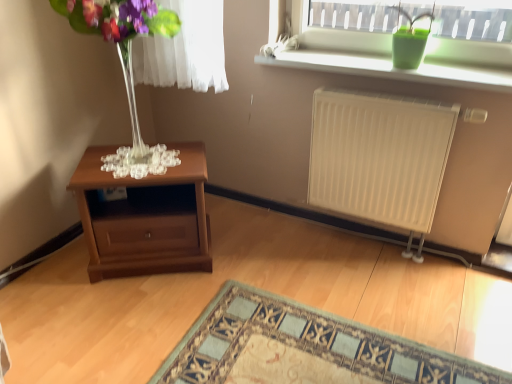
Question: Considering the relative sizes of white matte radiator at right and transparent glass vase at left in the image provided, is white matte radiator at right taller than transparent glass vase at left?

Choices:
 (A) yes
 (B) no

Answer: (A)

Question: Considering the relative positions of white matte radiator at right and transparent glass vase at left in the image provided, is white matte radiator at right to the right of transparent glass vase at left from the viewer's perspective?

Choices:
 (A) yes
 (B) no

Answer: (A)

Question: Can you confirm if white matte radiator at right is positioned to the left of transparent glass vase at left?

Choices:
 (A) no
 (B) yes

Answer: (A)

Question: From the image's perspective, is white matte radiator at right beneath transparent glass vase at left?

Choices:
 (A) no
 (B) yes

Answer: (B)

Question: Would you say white matte radiator at right contains transparent glass vase at left?

Choices:
 (A) no
 (B) yes

Answer: (A)

Question: From a real-world perspective, does white matte radiator at right sit lower than transparent glass vase at left?

Choices:
 (A) yes
 (B) no

Answer: (A)

Question: Would you consider transparent glass vase at left to be distant from carpet with intricate pattern at lower center?

Choices:
 (A) no
 (B) yes

Answer: (B)

Question: From a real-world perspective, is transparent glass vase at left beneath carpet with intricate pattern at lower center?

Choices:
 (A) yes
 (B) no

Answer: (B)

Question: Does transparent glass vase at left have a greater height compared to carpet with intricate pattern at lower center?

Choices:
 (A) no
 (B) yes

Answer: (B)

Question: Can you confirm if transparent glass vase at left is thinner than carpet with intricate pattern at lower center?

Choices:
 (A) no
 (B) yes

Answer: (B)

Question: Is transparent glass vase at left wider than carpet with intricate pattern at lower center?

Choices:
 (A) yes
 (B) no

Answer: (B)

Question: Is transparent glass vase at left positioned with its back to carpet with intricate pattern at lower center?

Choices:
 (A) yes
 (B) no

Answer: (B)

Question: From the image's perspective, is green matte vase at upper right under white matte radiator at right?

Choices:
 (A) yes
 (B) no

Answer: (B)